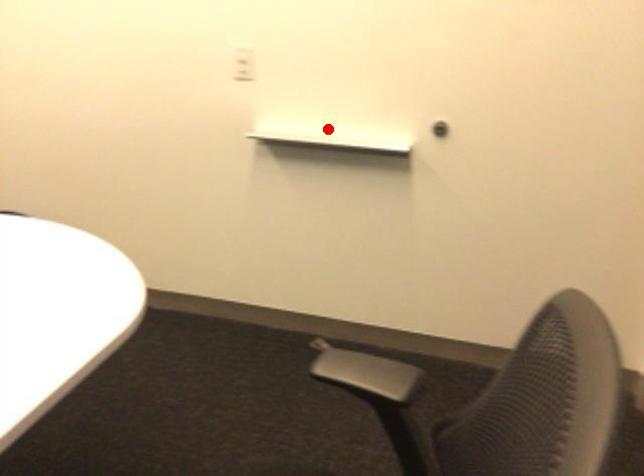
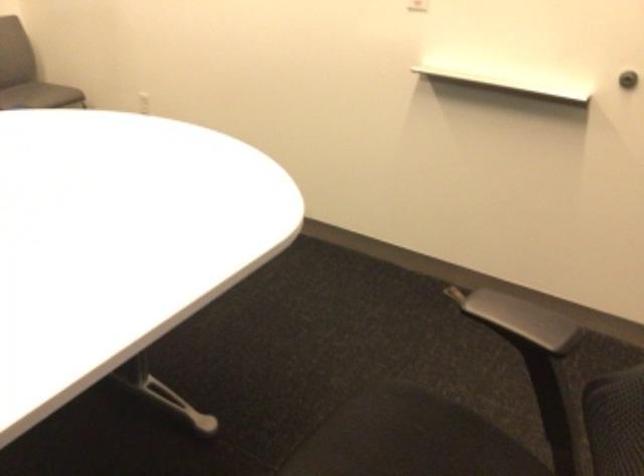
The point at the highlighted location is marked in the first image. Where is the corresponding point in the second image?

(504, 72)